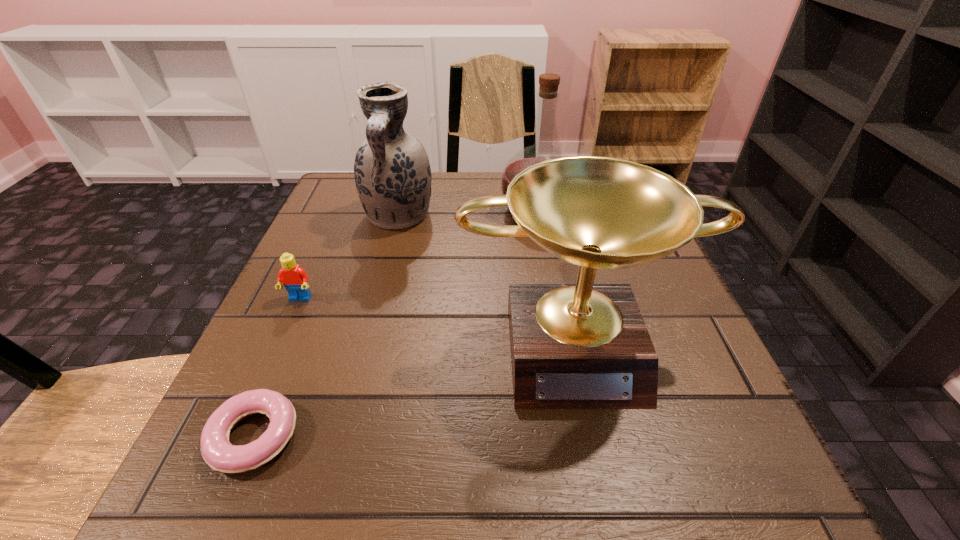
At what (x,y) coordinates should I click in order to perform the action: click on liquor situated at the far edge. Please return your answer as a coordinate pair (x, y). Image resolution: width=960 pixels, height=540 pixels. Looking at the image, I should click on (548, 94).

Find the location of a particular element. The width and height of the screenshot is (960, 540). vase that is at the far edge is located at coordinates (392, 172).

Locate an element on the screen. Image resolution: width=960 pixels, height=540 pixels. object that is positioned at the near edge is located at coordinates (217, 451).

This screenshot has height=540, width=960. Find the location of `vase at the left edge`. vase at the left edge is located at coordinates (392, 172).

Where is `Lego positioned at the left edge`? This screenshot has height=540, width=960. Lego positioned at the left edge is located at coordinates (295, 280).

Find the location of a particular element. doughnut located in the left edge section of the desktop is located at coordinates (217, 451).

Where is `liquor present at the right edge`? The width and height of the screenshot is (960, 540). liquor present at the right edge is located at coordinates (548, 94).

At what (x,y) coordinates should I click in order to perform the action: click on award situated at the right edge. Please return your answer as a coordinate pair (x, y). This screenshot has height=540, width=960. Looking at the image, I should click on (573, 346).

Find the location of `object located at the far left corner`. object located at the far left corner is located at coordinates (392, 172).

At what (x,y) coordinates should I click in order to perform the action: click on object that is at the near left corner. Please return your answer as a coordinate pair (x, y). This screenshot has width=960, height=540. Looking at the image, I should click on (217, 451).